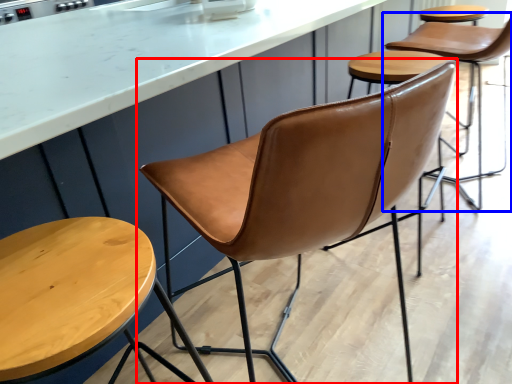
Question: Which point is closer to the camera, chair (highlighted by a red box) or chair (highlighted by a blue box)?

Choices:
 (A) chair
 (B) chair

Answer: (A)